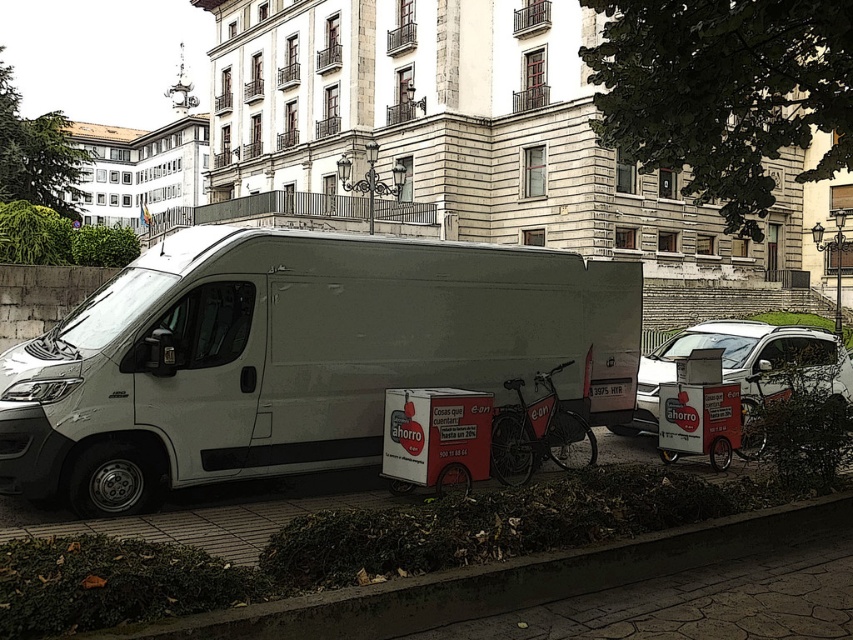
You are a delivery person trying to park your bike between the concrete at lower left and the metallic red cooler at center. Can you fit your bike there?

The concrete at lower left is to the right of the metallic red cooler at center, so there is no space between them for the bike to fit.

You are a delivery person who needs to place a package on the concrete at lower left and the metallic red cooler at center. Which surface can you place the package on without it falling over?

The metallic red cooler at center is taller than the concrete at lower left, so placing the package on the metallic red cooler at center would provide a more stable surface to prevent it from falling over.